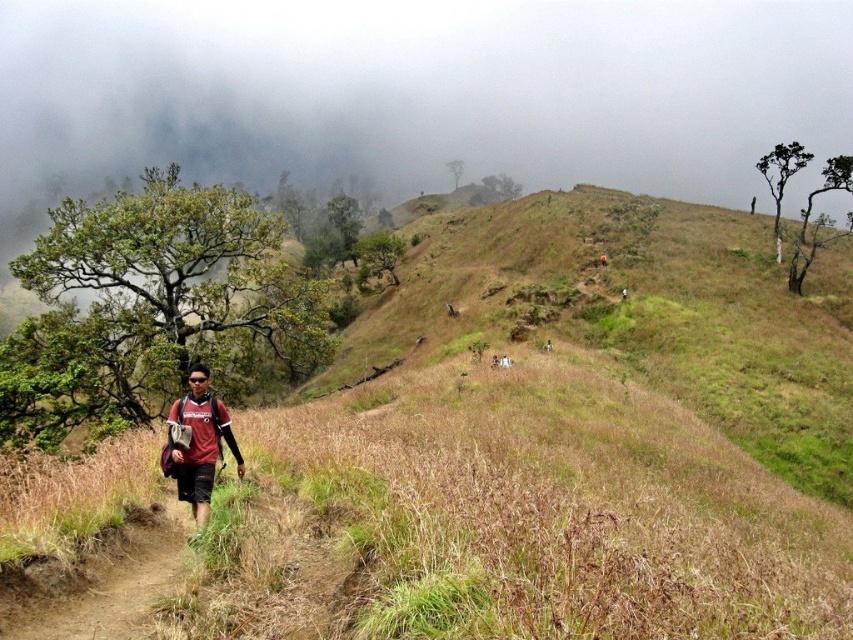
You are a hiker standing at the point marked as point (552, 444). You want to take a photo of the dry grass at center. Which direction should you face to capture it?

The dry grass at center is located at point (552, 444), so you should face directly towards that point to capture it in your photo.

You are a photographer aiming to capture a landscape shot of the dry grass at center and the matte red shirt at center. Given their sizes, which object would appear more prominent in your photo?

The dry grass at center has a larger size compared to the matte red shirt at center, so it would appear more prominent in the photo.